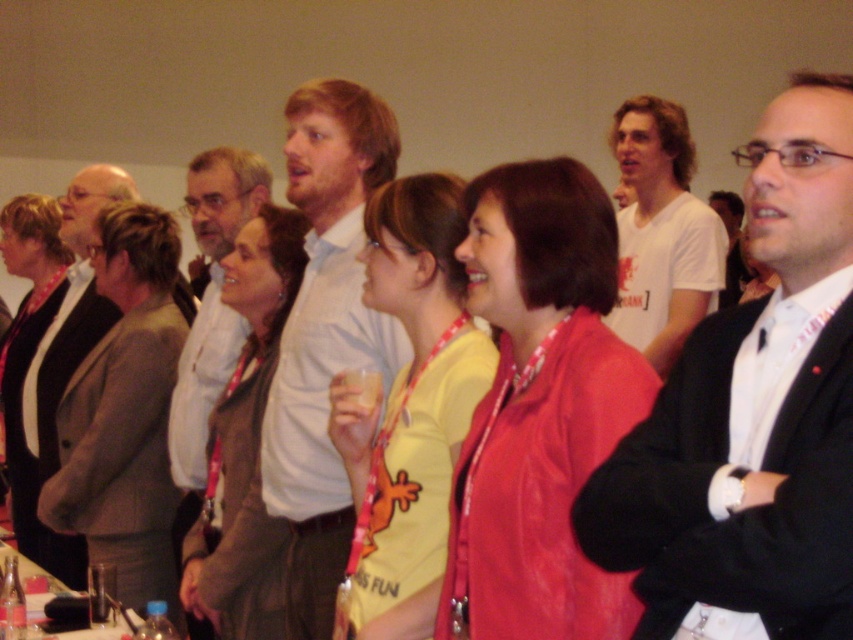
Question: Which object is positioned farthest from the yellow fabric shirt at center?

Choices:
 (A) light brown fabric jacket at left
 (B) light brown leather jacket at left
 (C) white cotton t-shirt at upper right
 (D) brown leather jacket at center

Answer: (B)

Question: Which object is the closest to the white cotton t-shirt at upper right?

Choices:
 (A) light brown leather jacket at left
 (B) black suit at right

Answer: (B)

Question: Among these objects, which one is farthest from the camera?

Choices:
 (A) light blue shirt at center
 (B) light brown fabric jacket at left
 (C) brown leather jacket at center

Answer: (B)

Question: Is yellow fabric shirt at center thinner than brown leather jacket at center?

Choices:
 (A) no
 (B) yes

Answer: (B)

Question: Does yellow fabric shirt at center appear on the right side of light brown fabric jacket at left?

Choices:
 (A) yes
 (B) no

Answer: (A)

Question: Is black suit at right to the left of yellow fabric shirt at center from the viewer's perspective?

Choices:
 (A) yes
 (B) no

Answer: (B)